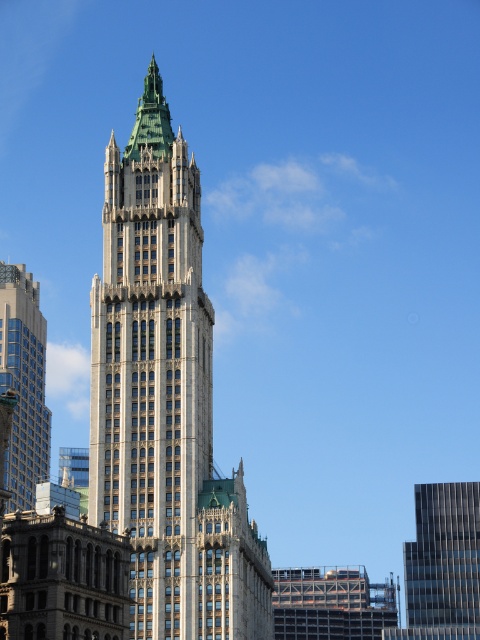
Is white stone tower at center thinner than glassy gray skyscraper at right?

No.

The image size is (480, 640). Identify the location of white stone tower at center. (165, 401).

Does glassy gray skyscraper at right have a lesser height compared to matte glass skyscraper at left?

Correct, glassy gray skyscraper at right is not as tall as matte glass skyscraper at left.

Does glassy gray skyscraper at right appear on the right side of matte glass skyscraper at left?

Yes, glassy gray skyscraper at right is to the right of matte glass skyscraper at left.

Does point (437, 497) come in front of point (44, 397)?

Yes, point (437, 497) is closer to viewer.

You are a GUI agent. You are given a task and a screenshot of the screen. Output one action in this format:
    pyautogui.click(x=<x>, y=<y>)
    Task: Click on the glassy gray skyscraper at right
    The width and height of the screenshot is (480, 640).
    Given the screenshot: What is the action you would take?
    pyautogui.click(x=443, y=564)

Who is positioned more to the right, white stone tower at center or matte glass skyscraper at left?

white stone tower at center

Between point (142, 163) and point (45, 404), which one is positioned behind?

The point (45, 404) is more distant.

Does point (143, 552) come in front of point (32, 451)?

Yes, it is.

Find the location of a particular element. This screenshot has width=480, height=640. white stone tower at center is located at coordinates (165, 401).